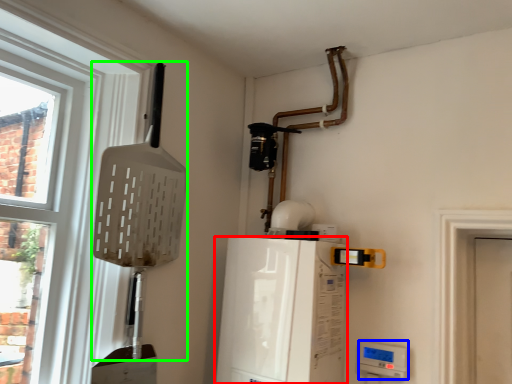
Question: Which object is the closest to the appliance (highlighted by a red box)? Choose among these: appliance (highlighted by a blue box) or shovel (highlighted by a green box).

Choices:
 (A) appliance
 (B) shovel

Answer: (A)